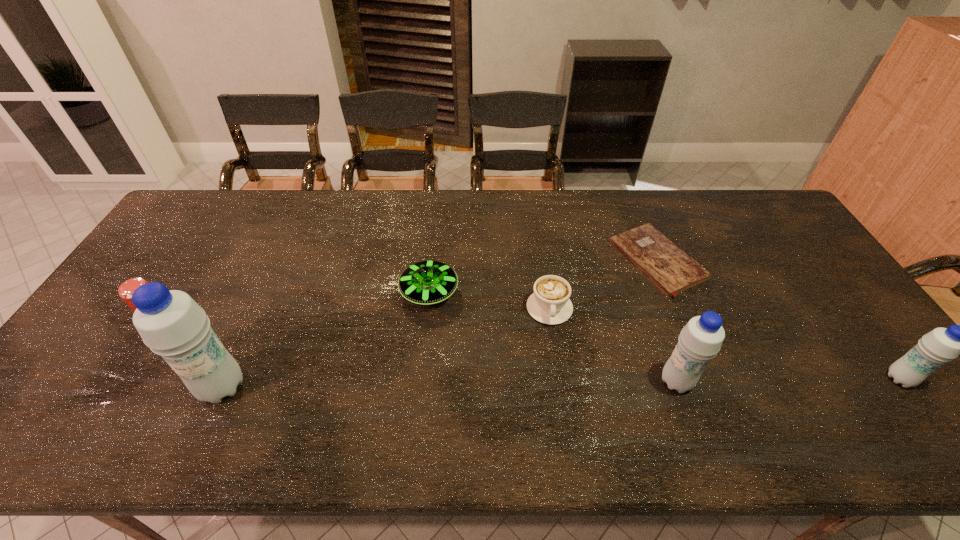
Where is `water bottle that stands as the second closest to the tallest object`? The width and height of the screenshot is (960, 540). water bottle that stands as the second closest to the tallest object is located at coordinates [941, 345].

The height and width of the screenshot is (540, 960). I want to click on free space that satisfies the following two spatial constraints: 1. on the front side of the leftmost water bottle; 2. on the left side of the leftmost object, so click(x=110, y=387).